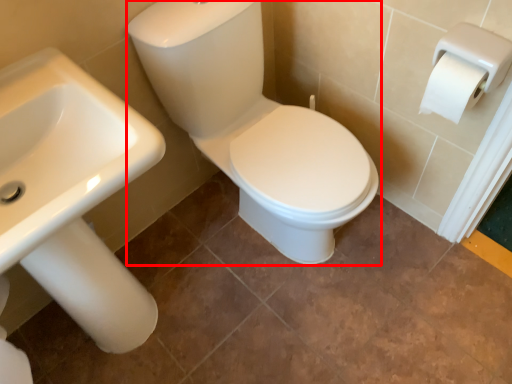
Question: From the image's perspective, where is sit (annotated by the red box) located relative to sink?

Choices:
 (A) above
 (B) below

Answer: (A)